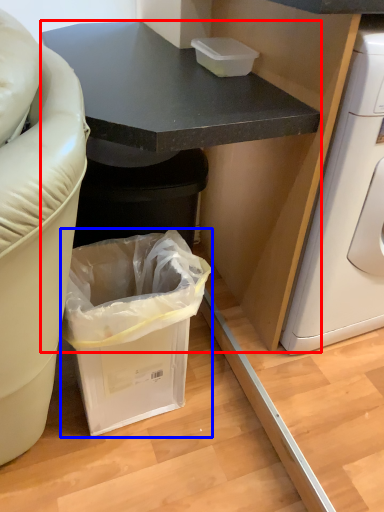
Question: Among these objects, which one is farthest to the camera, cabinetry (highlighted by a red box) or trash bin/can (highlighted by a blue box)?

Choices:
 (A) cabinetry
 (B) trash bin/can

Answer: (B)